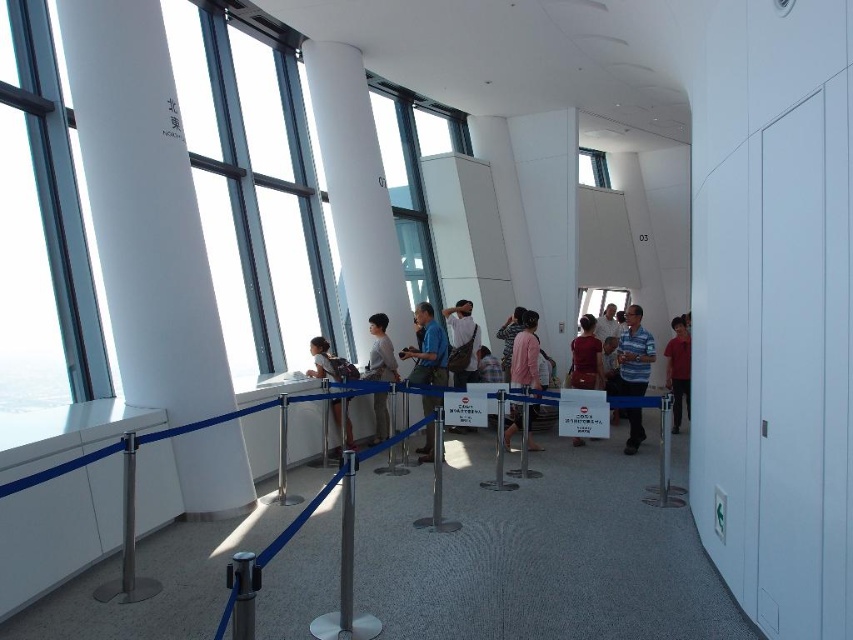
You are standing at point A in the building. You need to reach the silver metallic barrier at center located at point B. The coordinates of point A are given as (296,522). Can you determine the direction you should walk to reach the barrier?

The silver metallic barrier at center is located at point B, which is the same as the coordinates of point A. Therefore, you are already at the silver metallic barrier at center.

From the picture: You are a visitor standing at the entrance of the observation deck and want to reach the white smooth column at center. The path is clear except for a 3 meter wide maintenance area between you and the column. Can you walk straight to the column without crossing the maintenance area?

The white smooth column at center is 8.63 meters away from the viewer. Since the maintenance area is only 3 meters wide, there is enough space to walk around it and reach the column without crossing the maintenance area.